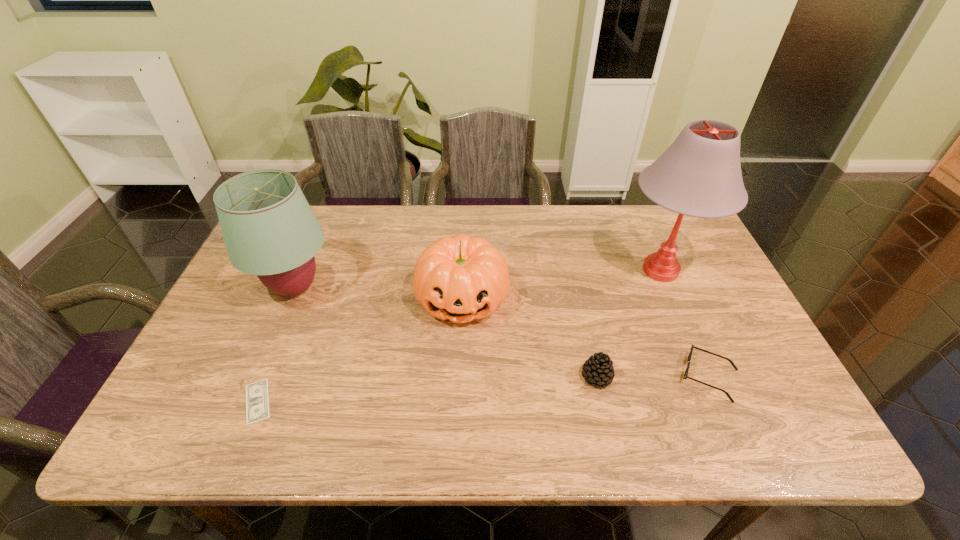
Where is `table lamp`? Image resolution: width=960 pixels, height=540 pixels. table lamp is located at coordinates (699, 175).

Locate an element on the screen. This screenshot has height=540, width=960. the fifth shortest object is located at coordinates (269, 229).

The image size is (960, 540). Identify the location of the fourth object from right to left. (460, 278).

Identify the location of the fourth shortest object. The width and height of the screenshot is (960, 540). (460, 278).

Identify the location of the third object from right to left. This screenshot has height=540, width=960. (598, 369).

Where is `the third shortest object`? Image resolution: width=960 pixels, height=540 pixels. the third shortest object is located at coordinates (598, 369).

Where is `sunglasses`? Image resolution: width=960 pixels, height=540 pixels. sunglasses is located at coordinates (685, 376).

Find the location of a particular element. The image size is (960, 540). money is located at coordinates (257, 398).

The image size is (960, 540). I want to click on free space located 0.100m on the front-facing side of the table lamp, so pyautogui.click(x=583, y=270).

Locate an element on the screen. free space located on the front-facing side of the table lamp is located at coordinates (560, 270).